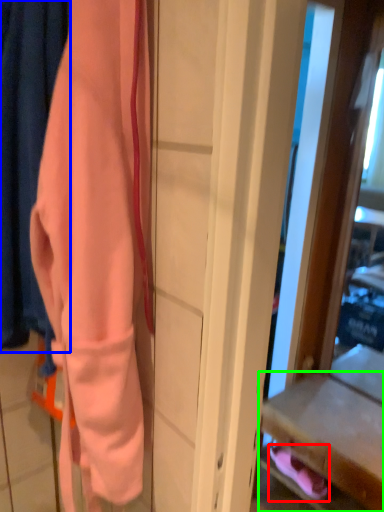
Question: Estimate the real-world distances between objects in this image. Which object is closer to footwear (highlighted by a red box), curtain (highlighted by a blue box) or drawer (highlighted by a green box)?

Choices:
 (A) curtain
 (B) drawer

Answer: (B)